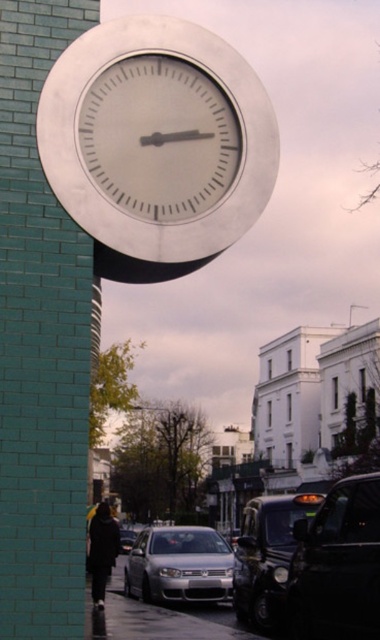
You are standing in front of a clock on a teal brick wall. You want to place a small sticker exactly at point (354, 568) on the clock face. If your hand can reach up to 9 meters, can you reach that point?

The distance of point (354, 568) from viewer is 9.27 meters, which is slightly beyond the 9 meters your hand can reach. Therefore, you cannot reach that point.

You are standing on the sidewalk and see the shiny black car at lower right and the silver metallic sedan at lower center. Which car is closer to the street corner?

The shiny black car at lower right is positioned on the right side of silver metallic sedan at lower center, so it is closer to the street corner.

You are a painter standing in front of the teal brick wall. You want to hang a new painting that is the same width as the silver metallic sedan at lower center. Can the silver metallic clock at upper center fit horizontally on the same wall without overlapping the painting?

The silver metallic clock at upper center has a lesser width compared to the silver metallic sedan at lower center. Therefore, the clock can fit horizontally on the wall without overlapping the painting if placed appropriately.